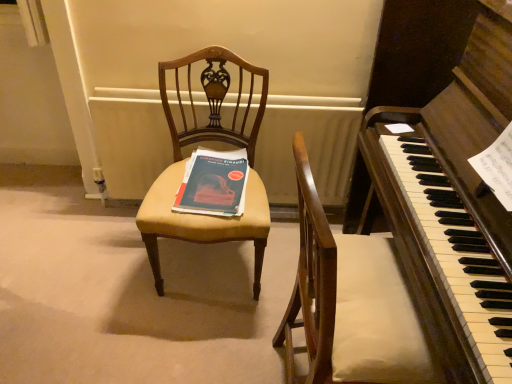
Find the location of a particular element. The width and height of the screenshot is (512, 384). free spot below matte yellow fabric chair at center (from a real-world perspective) is located at coordinates (206, 272).